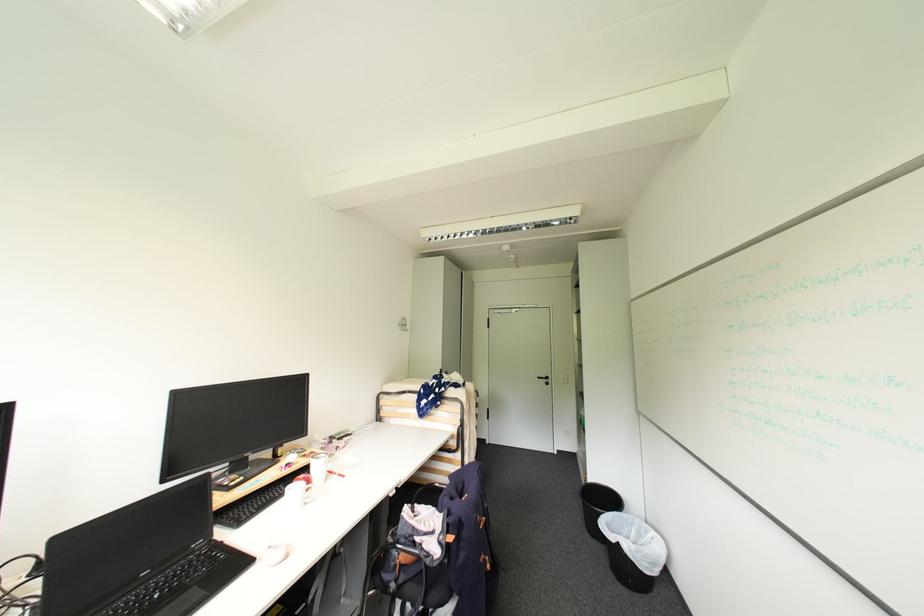
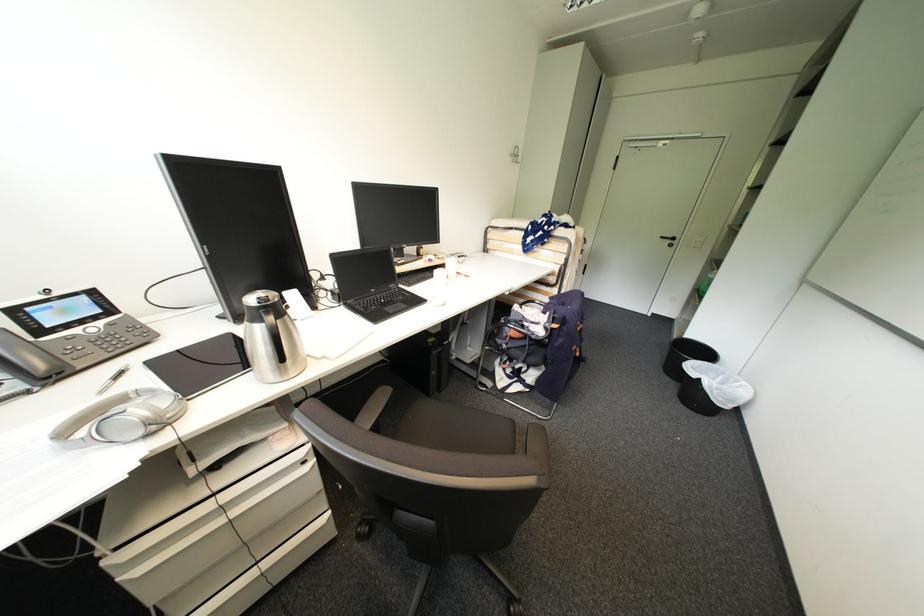
The images are taken continuously from a first-person perspective. In which direction is your viewpoint rotating?

The camera rotated toward left-down.